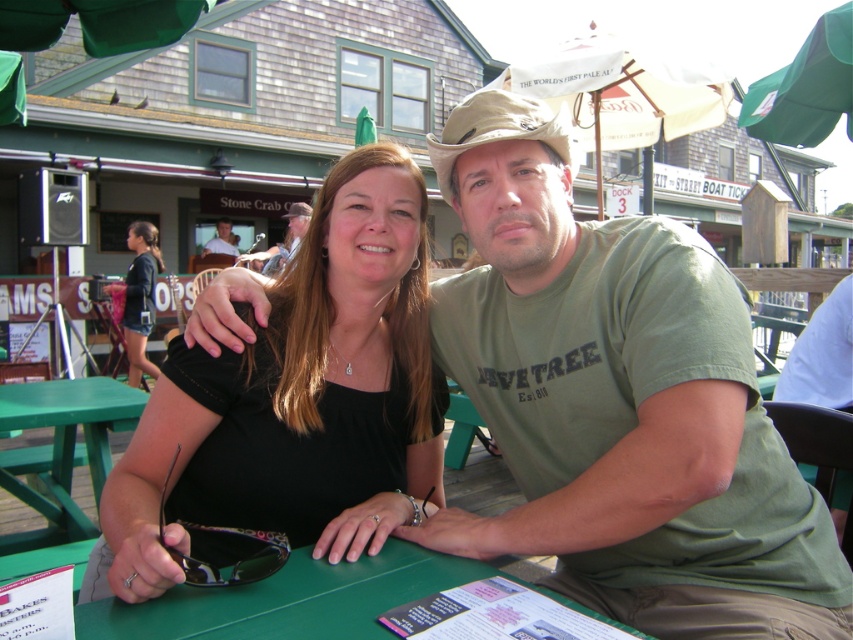
Question: Estimate the real-world distances between objects in this image. Which object is farther from the black matte sunglasses at center?

Choices:
 (A) matte khaki hat at upper center
 (B) green plastic table at center
 (C) tan fabric cowboy hat at center

Answer: (A)

Question: Can you confirm if green cotton shirt at center is positioned to the right of matte khaki hat at upper center?

Choices:
 (A) yes
 (B) no

Answer: (A)

Question: Which of the following is the farthest from the observer?

Choices:
 (A) (370, 154)
 (B) (227, 252)

Answer: (B)

Question: Which object appears closest to the camera in this image?

Choices:
 (A) light brown wooden table at center
 (B) green cotton shirt at center
 (C) black rubber goggles at center

Answer: (C)

Question: Is tan fabric cowboy hat at center smaller than black rubber goggles at center?

Choices:
 (A) yes
 (B) no

Answer: (B)

Question: Can you confirm if black rubber goggles at center is positioned to the right of matte khaki hat at upper center?

Choices:
 (A) yes
 (B) no

Answer: (A)